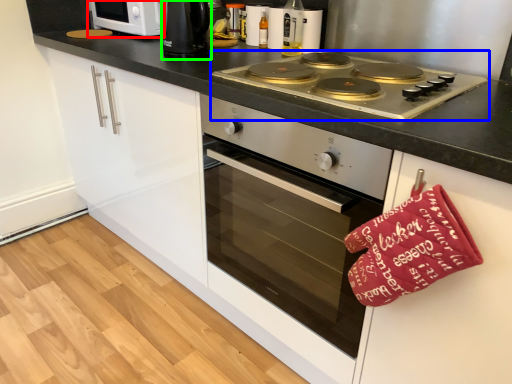
Question: Considering the real-world distances, which object is farthest from home appliance (highlighted by a red box)? gas stove (highlighted by a blue box) or kitchen appliance (highlighted by a green box)?

Choices:
 (A) gas stove
 (B) kitchen appliance

Answer: (A)